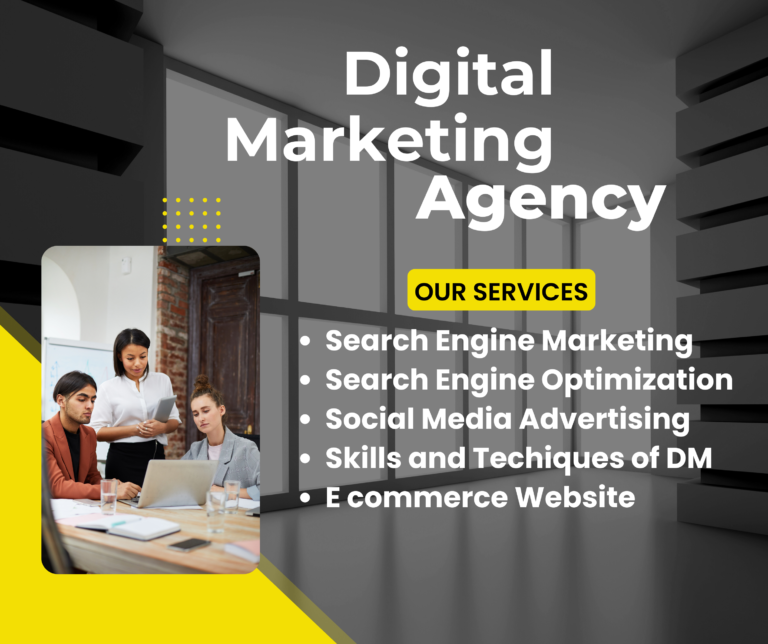
At what (x,y) coordinates should I click in order to perform the action: click on glass. Please return your answer as a coordinate pair (x, y). This screenshot has width=768, height=644. Looking at the image, I should click on (104, 495).